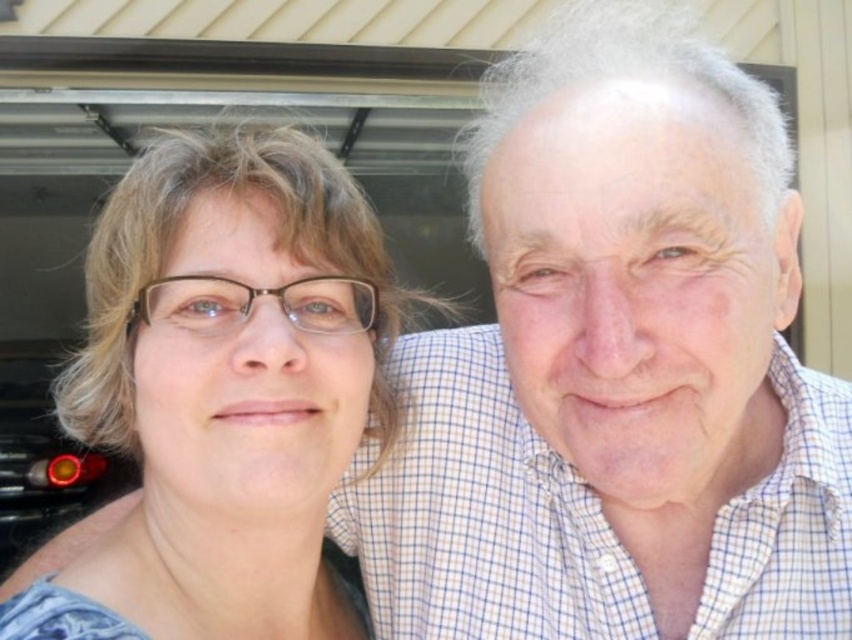
Question: Can you confirm if matte blue shirt at center is smaller than matte red taillight at lower left?

Choices:
 (A) yes
 (B) no

Answer: (A)

Question: Among these objects, which one is farthest from the camera?

Choices:
 (A) matte blue shirt at center
 (B) matte red taillight at lower left

Answer: (B)

Question: Observing the image, what is the correct spatial positioning of matte blue shirt at center in reference to matte red taillight at lower left?

Choices:
 (A) left
 (B) right

Answer: (B)

Question: Is matte blue shirt at center further to camera compared to matte red taillight at lower left?

Choices:
 (A) no
 (B) yes

Answer: (A)